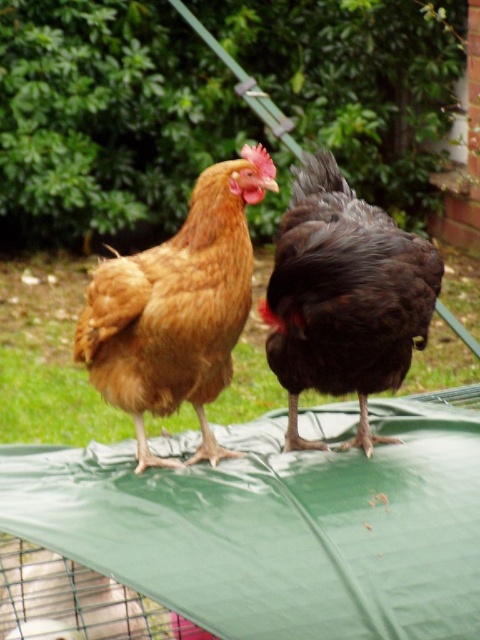
Question: Is golden brown feathered chicken at center in front of dark brown glossy chicken at right?

Choices:
 (A) no
 (B) yes

Answer: (B)

Question: Which point appears farthest from the camera in this image?

Choices:
 (A) (300, 244)
 (B) (245, 243)

Answer: (A)

Question: Which of the following is the closest to the observer?

Choices:
 (A) click(324, 289)
 (B) click(242, 205)

Answer: (A)

Question: From the image, what is the correct spatial relationship of golden brown feathered chicken at center in relation to dark brown glossy chicken at right?

Choices:
 (A) below
 (B) above

Answer: (A)

Question: Which of the following is the closest to the observer?

Choices:
 (A) (91, 316)
 (B) (383, 241)

Answer: (B)

Question: Is golden brown feathered chicken at center above dark brown glossy chicken at right?

Choices:
 (A) no
 (B) yes

Answer: (A)